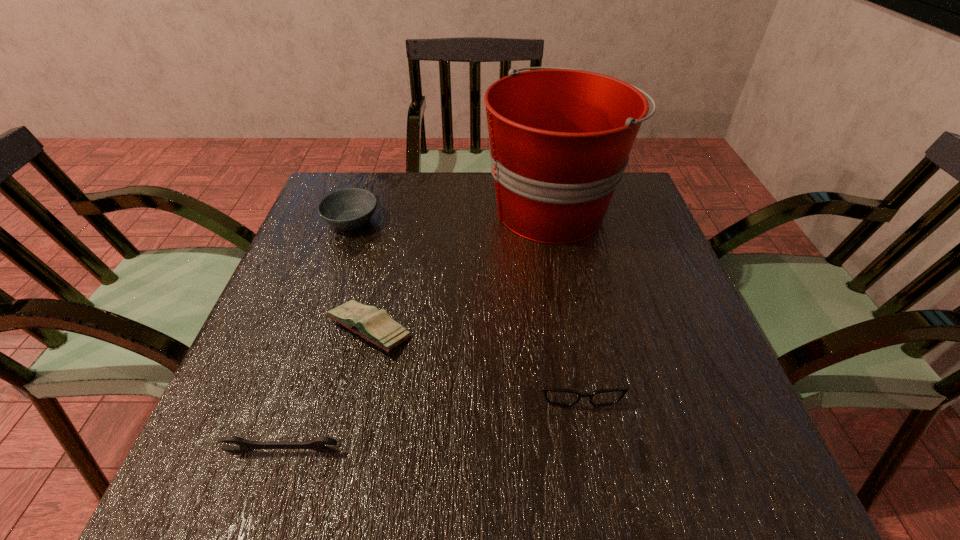
In the image, there is a desktop. Identify the location of vacant space at the near edge. (583, 481).

Where is `blank space at the left edge of the desktop`? blank space at the left edge of the desktop is located at coordinates (344, 268).

In the image, there is a desktop. Where is `free space at the right edge`? free space at the right edge is located at coordinates (636, 299).

Where is `free space at the far left corner of the desktop`? The height and width of the screenshot is (540, 960). free space at the far left corner of the desktop is located at coordinates (374, 181).

At what (x,y) coordinates should I click in order to perform the action: click on free space at the near left corner of the desktop. Please return your answer as a coordinate pair (x, y). The height and width of the screenshot is (540, 960). Looking at the image, I should click on (284, 449).

The height and width of the screenshot is (540, 960). What are the coordinates of `empty space that is in between the tallest object and the soup bowl` in the screenshot? It's located at (452, 215).

Where is `free space between the soup bowl and the bucket`? This screenshot has width=960, height=540. free space between the soup bowl and the bucket is located at coordinates (452, 215).

Where is `free area in between the spectacles and the tallest object`? Image resolution: width=960 pixels, height=540 pixels. free area in between the spectacles and the tallest object is located at coordinates (564, 292).

Find the location of a particular element. This screenshot has height=540, width=960. free space between the diary and the spectacles is located at coordinates (x=473, y=353).

You are a GUI agent. You are given a task and a screenshot of the screen. Output one action in this format:
    pyautogui.click(x=<x>, y=<y>)
    Task: Click on the free space between the spectacles and the soup bowl
    
    Given the screenshot: What is the action you would take?
    pyautogui.click(x=464, y=298)